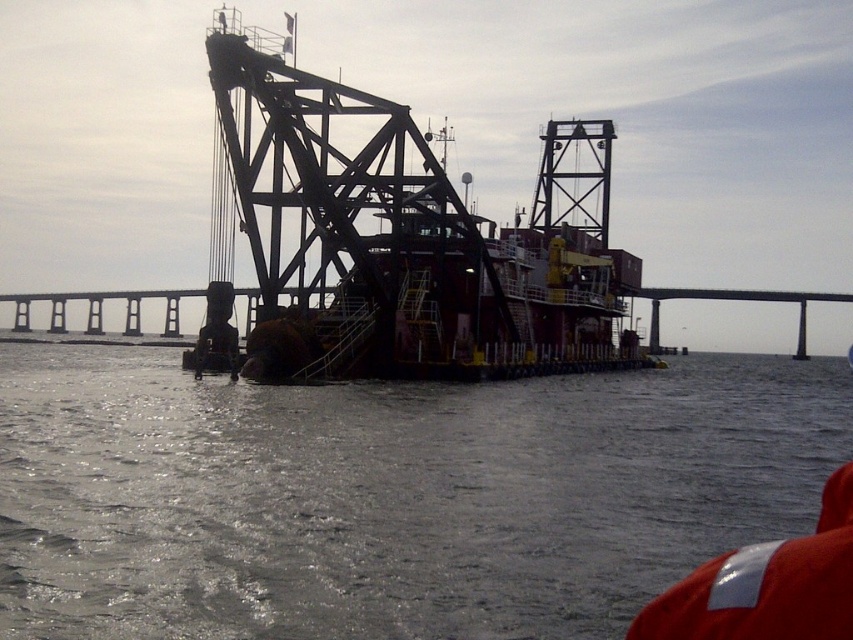
Question: Where is metallic structure at center located in relation to concrete bridge at center in the image?

Choices:
 (A) right
 (B) left

Answer: (B)

Question: Which object is closer to the camera taking this photo?

Choices:
 (A) concrete bridge at center
 (B) gray matte water at center

Answer: (B)

Question: Where is gray matte water at center located in relation to metallic structure at center in the image?

Choices:
 (A) below
 (B) above

Answer: (A)

Question: Which of these objects is positioned farthest from the concrete bridge at center?

Choices:
 (A) gray matte water at center
 (B) metallic structure at center

Answer: (A)

Question: Can you confirm if gray matte water at center is positioned to the right of concrete bridge at center?

Choices:
 (A) no
 (B) yes

Answer: (B)

Question: Among these objects, which one is nearest to the camera?

Choices:
 (A) metallic structure at center
 (B) concrete bridge at center
 (C) gray matte water at center

Answer: (C)